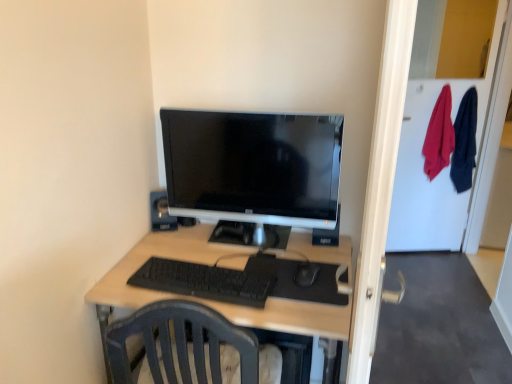
Where is `free space in front of black plastic speaker at upper center`? This screenshot has width=512, height=384. free space in front of black plastic speaker at upper center is located at coordinates (164, 249).